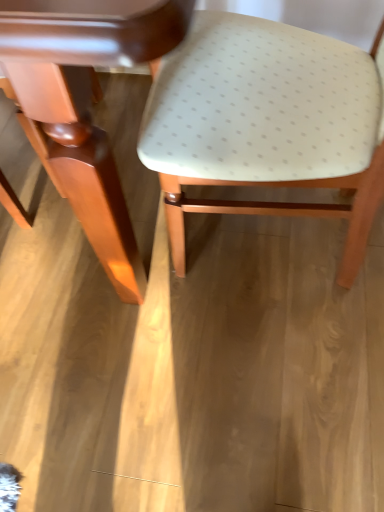
Find the location of a particular element. This screenshot has height=512, width=384. vacant region below matte white plastic chair at center (from a real-world perspective) is located at coordinates (279, 246).